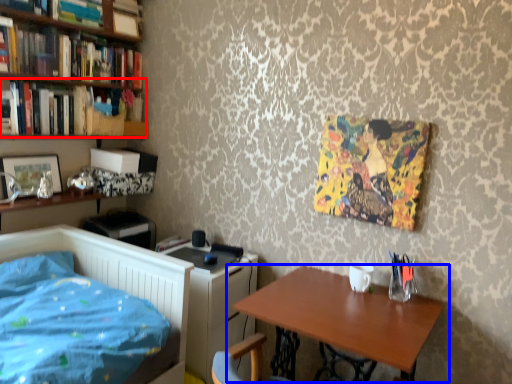
Question: Among these objects, which one is farthest to the camera, book (highlighted by a red box) or table (highlighted by a blue box)?

Choices:
 (A) book
 (B) table

Answer: (A)